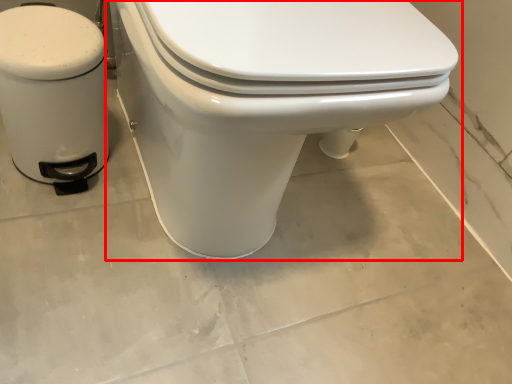
Question: From the image's perspective, considering the relative positions of toilet (annotated by the red box) and water heater in the image provided, where is toilet (annotated by the red box) located with respect to the staircase?

Choices:
 (A) below
 (B) above

Answer: (B)